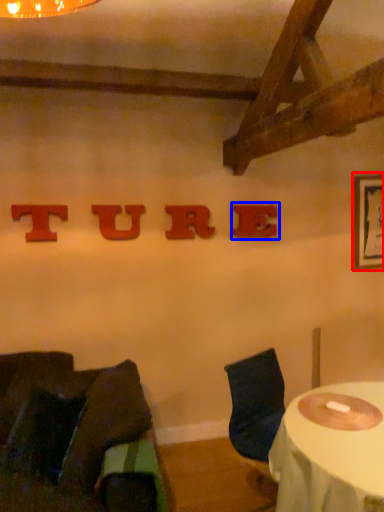
Question: Among these objects, which one is farthest to the camera, picture frame (highlighted by a red box) or alphabet (highlighted by a blue box)?

Choices:
 (A) picture frame
 (B) alphabet

Answer: (A)